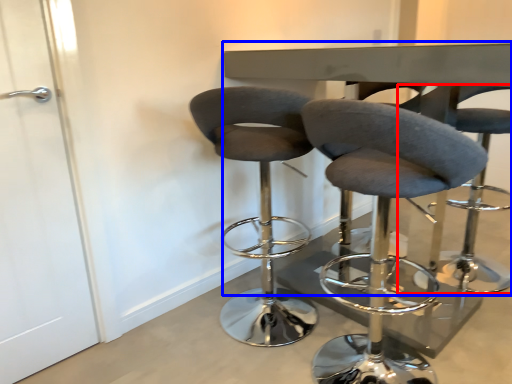
Question: Which object appears farthest to the camera in this image, chair (highlighted by a red box) or round table (highlighted by a blue box)?

Choices:
 (A) chair
 (B) round table

Answer: (A)